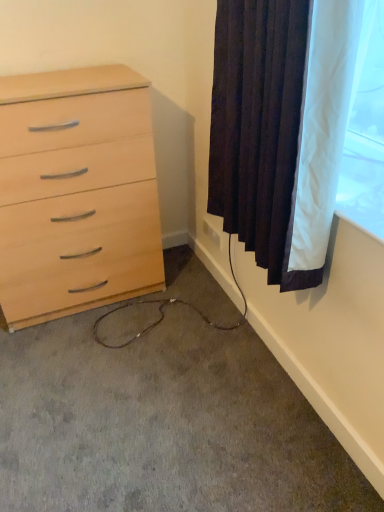
Question: Is white plastic outlet at lower right in front of carpet at lower left?

Choices:
 (A) no
 (B) yes

Answer: (A)

Question: Is white plastic outlet at lower right wider than carpet at lower left?

Choices:
 (A) yes
 (B) no

Answer: (B)

Question: Is white plastic outlet at lower right completely or partially outside of carpet at lower left?

Choices:
 (A) yes
 (B) no

Answer: (A)

Question: Considering the relative sizes of white plastic outlet at lower right and carpet at lower left in the image provided, is white plastic outlet at lower right bigger than carpet at lower left?

Choices:
 (A) no
 (B) yes

Answer: (A)

Question: Is white plastic outlet at lower right next to carpet at lower left and touching it?

Choices:
 (A) no
 (B) yes

Answer: (A)

Question: Could you tell me if white plastic outlet at lower right is turned towards carpet at lower left?

Choices:
 (A) yes
 (B) no

Answer: (B)

Question: Considering the relative sizes of carpet at lower left and light wood chest of drawers at left in the image provided, is carpet at lower left bigger than light wood chest of drawers at left?

Choices:
 (A) no
 (B) yes

Answer: (A)

Question: From a real-world perspective, is carpet at lower left located beneath light wood chest of drawers at left?

Choices:
 (A) yes
 (B) no

Answer: (A)

Question: Can light wood chest of drawers at left be found inside carpet at lower left?

Choices:
 (A) no
 (B) yes

Answer: (A)

Question: From a real-world perspective, is carpet at lower left positioned over light wood chest of drawers at left based on gravity?

Choices:
 (A) no
 (B) yes

Answer: (A)

Question: From the image's perspective, is carpet at lower left beneath light wood chest of drawers at left?

Choices:
 (A) no
 (B) yes

Answer: (B)

Question: Considering the relative sizes of carpet at lower left and light wood chest of drawers at left in the image provided, is carpet at lower left taller than light wood chest of drawers at left?

Choices:
 (A) no
 (B) yes

Answer: (A)

Question: From a real-world perspective, does light wood chest of drawers at left sit lower than carpet at lower left?

Choices:
 (A) no
 (B) yes

Answer: (A)